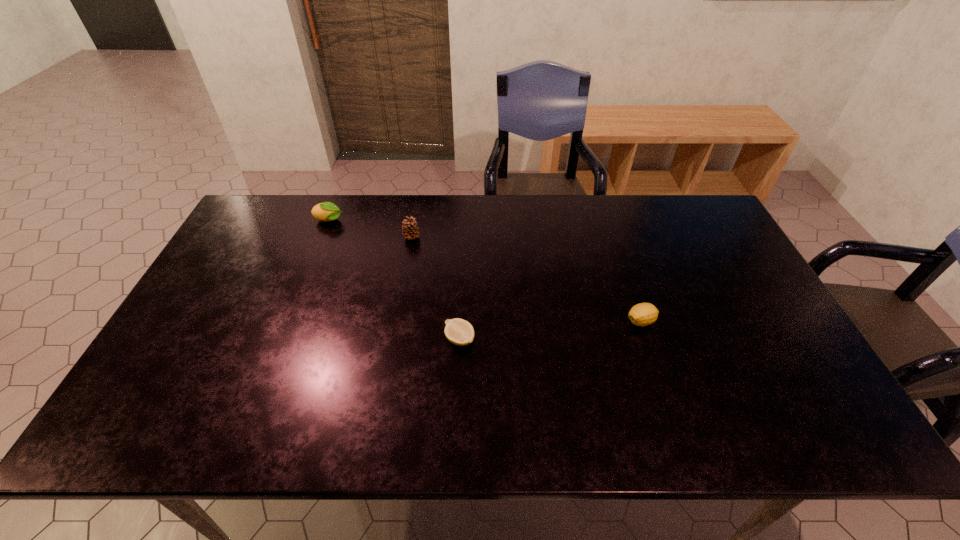
Where is `free space located at the stem end of the third tallest object`? Image resolution: width=960 pixels, height=540 pixels. free space located at the stem end of the third tallest object is located at coordinates (537, 321).

This screenshot has height=540, width=960. In order to click on blank space located 0.390m at the stem end of the third tallest object in this screenshot , I will do `click(481, 321)`.

Where is `free spot located at the stem end of the third tallest object`? This screenshot has width=960, height=540. free spot located at the stem end of the third tallest object is located at coordinates (507, 321).

The width and height of the screenshot is (960, 540). I want to click on vacant space located 0.180m on the back of the shortest object, so click(x=462, y=280).

Locate an element on the screen. The width and height of the screenshot is (960, 540). pinecone present at the far edge is located at coordinates (410, 230).

I want to click on lemon present at the far edge, so click(x=326, y=211).

In the image, there is a desktop. Where is `blank space at the far edge`? blank space at the far edge is located at coordinates coord(646,202).

At what (x,y) coordinates should I click in order to perform the action: click on vacant position at the near edge of the desktop. Please return your answer as a coordinate pair (x, y). Looking at the image, I should click on (213, 433).

Where is `vacant space at the right edge`? Image resolution: width=960 pixels, height=540 pixels. vacant space at the right edge is located at coordinates (688, 254).

The image size is (960, 540). What are the coordinates of `free space at the far left corner` in the screenshot? It's located at (266, 210).